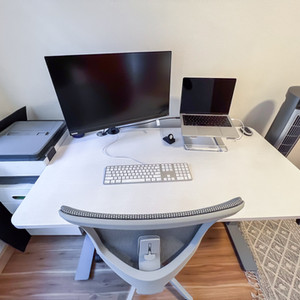
Where is `mouse`? This screenshot has width=300, height=300. mouse is located at coordinates (247, 129).